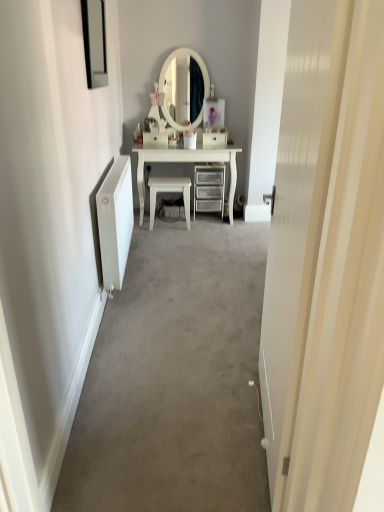
Question: Is white glossy drawer at center, the 1th drawer viewed from the left, inside or outside of black glass picture frame at upper left?

Choices:
 (A) inside
 (B) outside

Answer: (B)

Question: In terms of width, does white glossy drawer at center, the 1th drawer viewed from the left, look wider or thinner when compared to black glass picture frame at upper left?

Choices:
 (A) wide
 (B) thin

Answer: (A)

Question: Considering the real-world distances, which object is farthest from the white glossy chair at center?

Choices:
 (A) white glossy drawer at center, acting as the second drawer starting from the right
 (B) black glass picture frame at upper left
 (C) white wood door at center
 (D) white glossy drawer at center, which appears as the first drawer when viewed from the right
 (E) metallic silver chest of drawers at center

Answer: (C)

Question: Estimate the real-world distances between objects in this image. Which object is farther from the white glossy drawer at center, which appears as the first drawer when viewed from the right?

Choices:
 (A) black glass picture frame at upper left
 (B) white glossy chair at center
 (C) white wood door at center
 (D) white glossy drawer at center, the 1th drawer viewed from the left
 (E) metallic silver chest of drawers at center

Answer: (C)